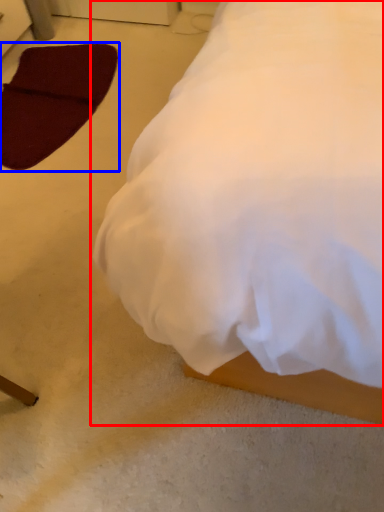
Question: Which of the following is the closest to the observer, bed (highlighted by a red box) or pad (highlighted by a blue box)?

Choices:
 (A) bed
 (B) pad

Answer: (A)